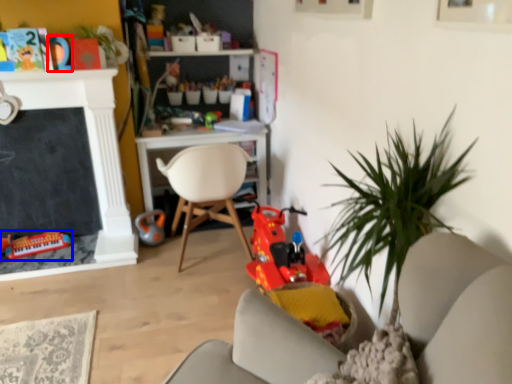
Question: Which point is closer to the camera, toy (highlighted by a red box) or toy (highlighted by a blue box)?

Choices:
 (A) toy
 (B) toy

Answer: (A)